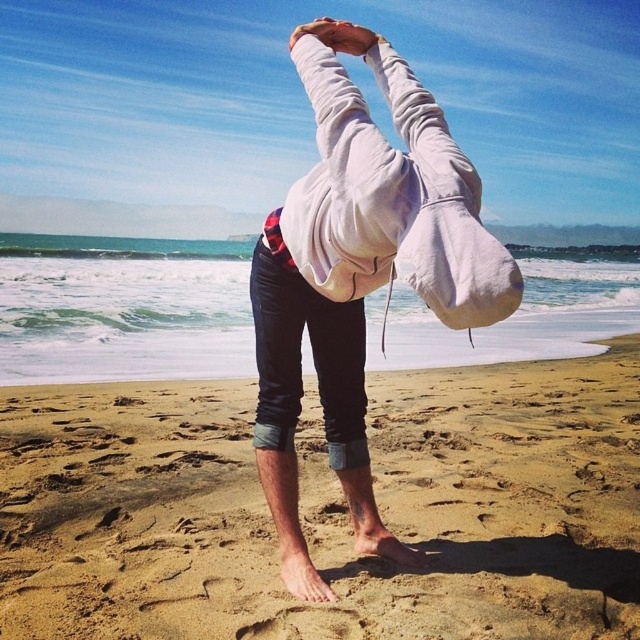
Question: Which point appears farthest from the camera in this image?

Choices:
 (A) (339, 289)
 (B) (228, 401)

Answer: (B)

Question: Can you confirm if sandy yellow sand at lower center is positioned to the right of gray fleece hoodie at center?

Choices:
 (A) no
 (B) yes

Answer: (B)

Question: Which point is closer to the camera taking this photo?

Choices:
 (A) (278, 230)
 (B) (170, 474)

Answer: (A)

Question: Does sandy yellow sand at lower center appear on the left side of gray fleece hoodie at center?

Choices:
 (A) yes
 (B) no

Answer: (B)

Question: Is sandy yellow sand at lower center above gray fleece hoodie at center?

Choices:
 (A) yes
 (B) no

Answer: (B)